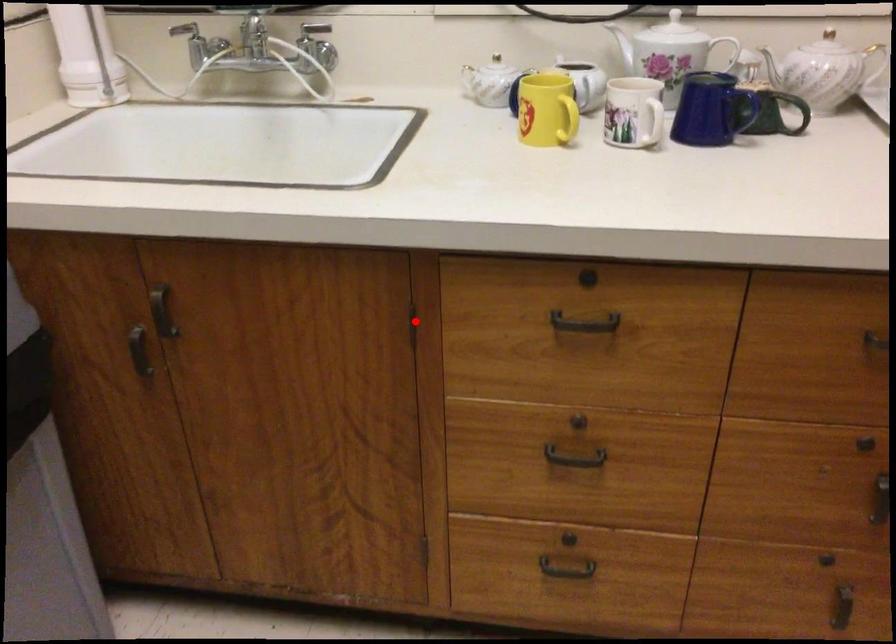
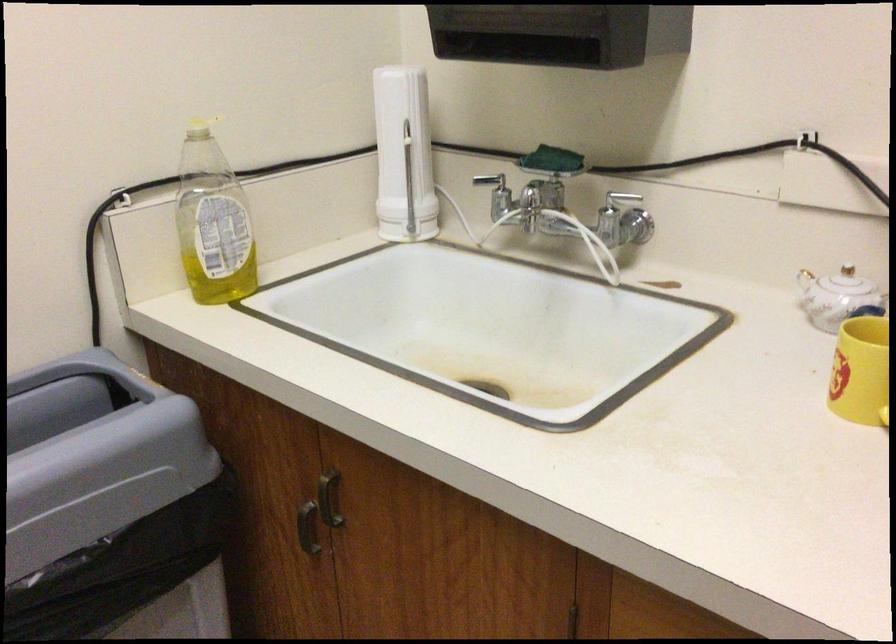
Locate, in the second image, the point that corresponds to the highlighted location in the first image.

(576, 623)